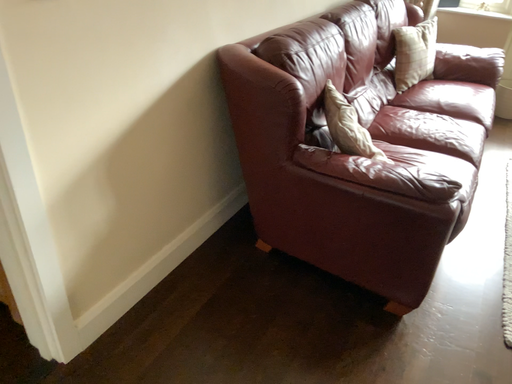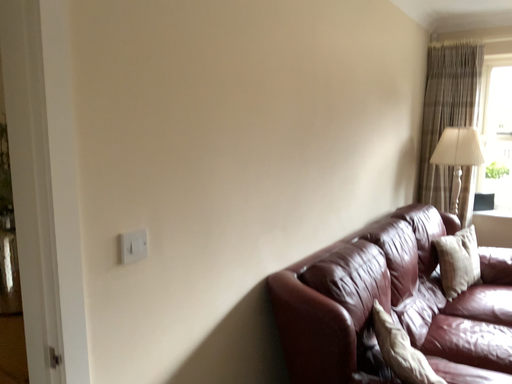
Question: How did the camera likely rotate when shooting the video?

Choices:
 (A) rotated right
 (B) rotated left

Answer: (B)